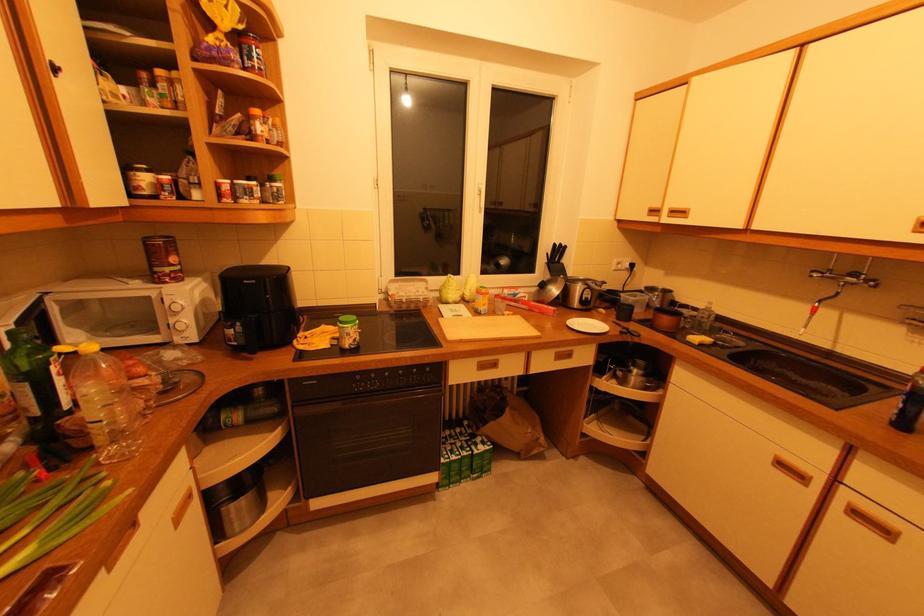
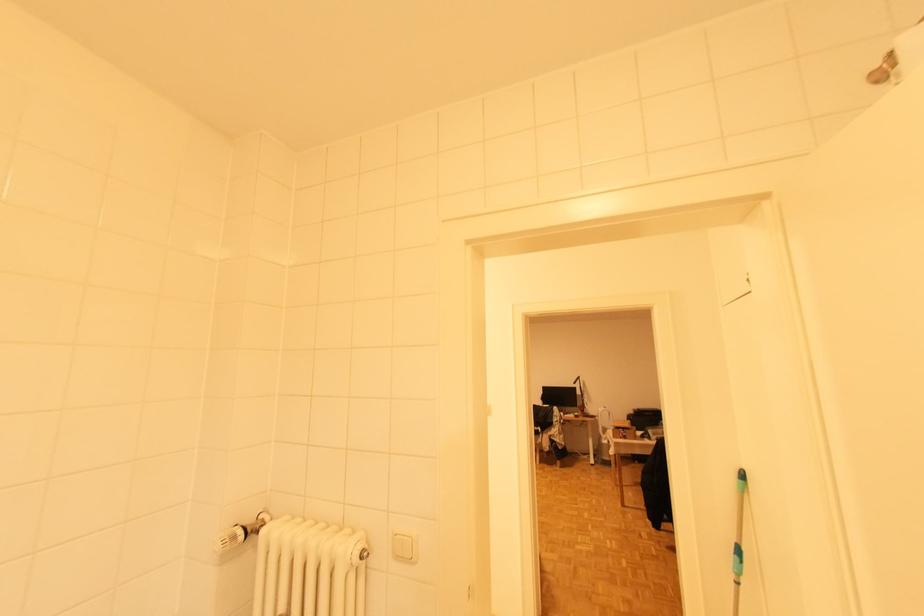
Question: I am providing you with two images of the same scene from different viewpoints. Which of the following objects are not visible in image2?

Choices:
 (A) mop handle
 (B) white light switch
 (C) pot lid handle
 (D) black wire basket

Answer: (C)